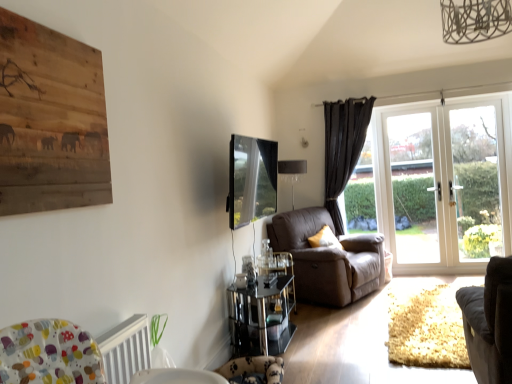
Question: Considering the relative sizes of brown leather couch at center, which appears as the second chair when viewed from the front, and white glass door at right in the image provided, is brown leather couch at center, which appears as the second chair when viewed from the front, taller than white glass door at right?

Choices:
 (A) no
 (B) yes

Answer: (A)

Question: From the image's perspective, is brown leather couch at center, which appears as the second chair when viewed from the front, located beneath white glass door at right?

Choices:
 (A) no
 (B) yes

Answer: (B)

Question: Does brown leather couch at center, which appears as the second chair when viewed from the front, have a greater width compared to white glass door at right?

Choices:
 (A) no
 (B) yes

Answer: (B)

Question: Are brown leather couch at center, which appears as the second chair when viewed from the front, and white glass door at right making contact?

Choices:
 (A) yes
 (B) no

Answer: (B)

Question: From a real-world perspective, is brown leather couch at center, which is counted as the 1th chair, starting from the back, under white glass door at right?

Choices:
 (A) no
 (B) yes

Answer: (B)

Question: Is brown leather couch at center, which appears as the second chair when viewed from the front, thinner than white glass door at right?

Choices:
 (A) yes
 (B) no

Answer: (B)

Question: Does white textured radiator at lower left lie in front of matte glass lampshade at upper center?

Choices:
 (A) yes
 (B) no

Answer: (A)

Question: Is white textured radiator at lower left directly adjacent to matte glass lampshade at upper center?

Choices:
 (A) no
 (B) yes

Answer: (A)

Question: Is white textured radiator at lower left not within matte glass lampshade at upper center?

Choices:
 (A) no
 (B) yes

Answer: (B)

Question: Is white textured radiator at lower left shorter than matte glass lampshade at upper center?

Choices:
 (A) yes
 (B) no

Answer: (A)

Question: Is white textured radiator at lower left taller than matte glass lampshade at upper center?

Choices:
 (A) yes
 (B) no

Answer: (B)

Question: Is white textured radiator at lower left bigger than matte glass lampshade at upper center?

Choices:
 (A) no
 (B) yes

Answer: (A)

Question: Is velvet dark gray armchair at lower right, which is counted as the 2th chair, starting from the back, placed right next to wooden painting at upper left?

Choices:
 (A) no
 (B) yes

Answer: (A)